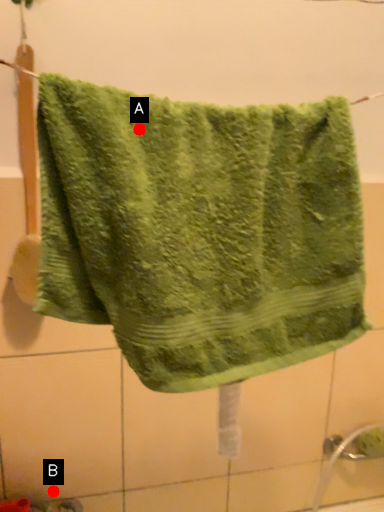
Question: Two points are circled on the image, labeled by A and B beside each circle. Among these points, which one is farthest from the camera?

Choices:
 (A) A is further
 (B) B is further

Answer: (B)